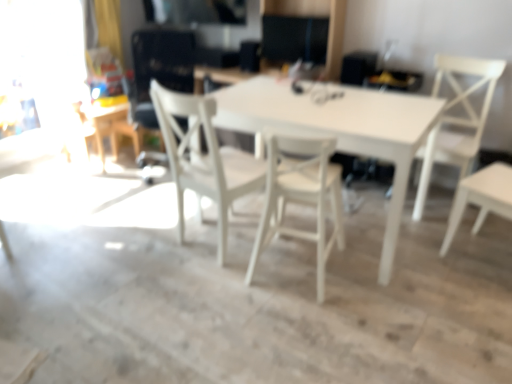
Locate an element on the screen. free space to the left of white wood chair at center, the 2th chair from the left is located at coordinates (211, 283).